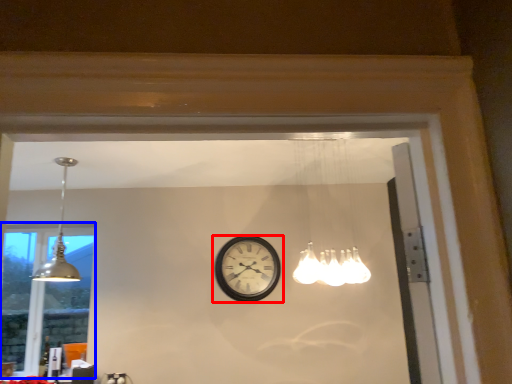
Question: Which point is further to the camera, wall clock (highlighted by a red box) or window (highlighted by a blue box)?

Choices:
 (A) wall clock
 (B) window

Answer: (B)